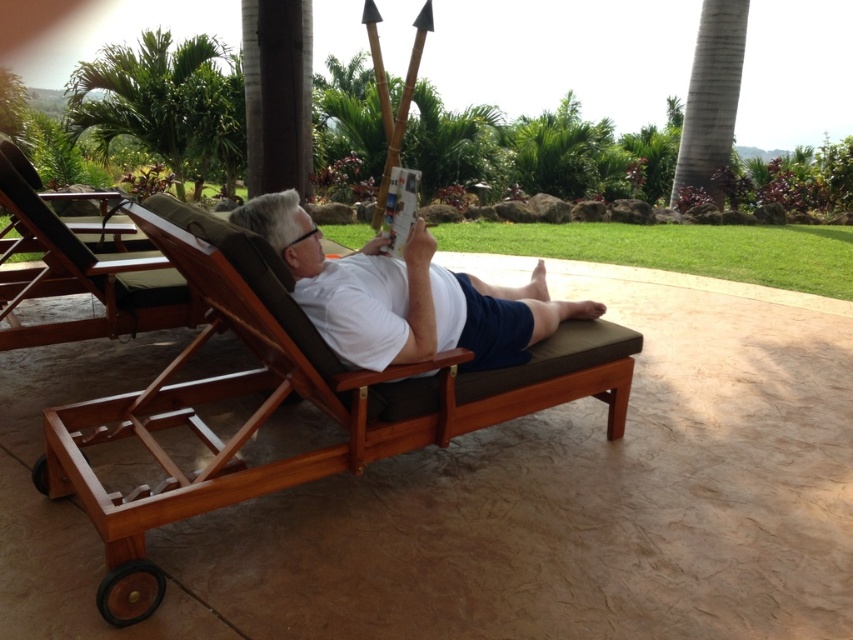
Does teak wood beach chair at center have a greater height compared to green leafy palm tree at upper left?

No, teak wood beach chair at center is not taller than green leafy palm tree at upper left.

Can you confirm if teak wood beach chair at center is smaller than green leafy palm tree at upper left?

Yes.

Who is more distant from viewer, (47, 492) or (164, 156)?

Point (164, 156)

The height and width of the screenshot is (640, 853). Find the location of `teak wood beach chair at center`. teak wood beach chair at center is located at coordinates (288, 400).

Which of these two, white matte shirt at center or brown wood beach chair at left, stands shorter?

Standing shorter between the two is white matte shirt at center.

Can you confirm if white matte shirt at center is bigger than brown wood beach chair at left?

No, white matte shirt at center is not bigger than brown wood beach chair at left.

Find the location of a particular element. The image size is (853, 640). white matte shirt at center is located at coordinates [x=404, y=296].

You are a GUI agent. You are given a task and a screenshot of the screen. Output one action in this format:
    pyautogui.click(x=<x>, y=<y>)
    Task: Click on the white matte shirt at center
    The width and height of the screenshot is (853, 640).
    Given the screenshot: What is the action you would take?
    pyautogui.click(x=404, y=296)

Which of these two, teak wood beach chair at center or brown wood beach chair at left, stands taller?

teak wood beach chair at center

Can you confirm if teak wood beach chair at center is positioned below brown wood beach chair at left?

Yes, teak wood beach chair at center is below brown wood beach chair at left.

Is point (525, 413) behind point (115, 300)?

No.

This screenshot has width=853, height=640. In order to click on teak wood beach chair at center in this screenshot , I will do `click(288, 400)`.